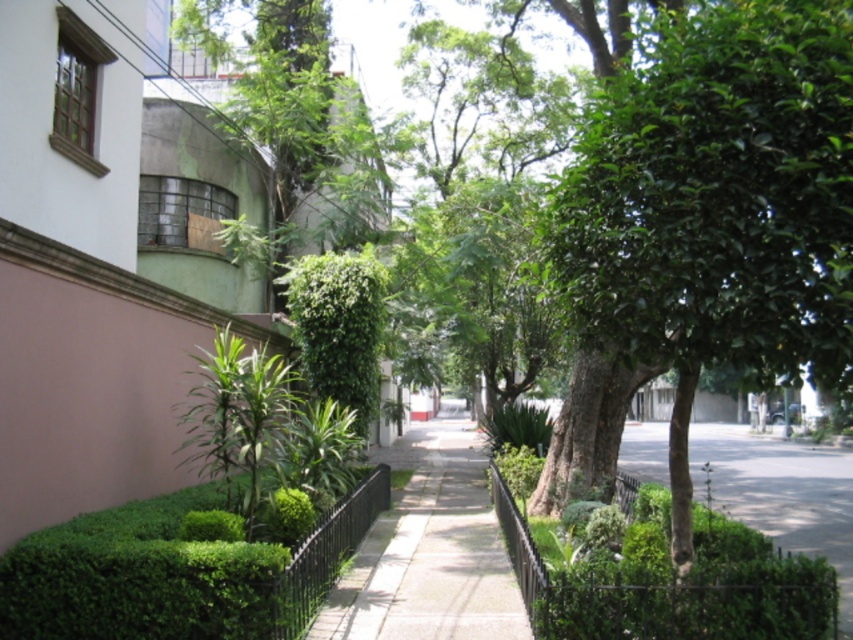
Is point (840, 378) more distant than point (167, 525)?

No, (840, 378) is closer to viewer.

Between green leafy tree at center and green leafy hedge at center, which one is positioned higher?

green leafy tree at center is above.

The height and width of the screenshot is (640, 853). Identify the location of green leafy tree at center. (718, 208).

Locate an element on the screen. The width and height of the screenshot is (853, 640). green leafy tree at center is located at coordinates (718, 208).

Does green leafy tree at center have a smaller size compared to paved concrete sidewalk at center?

Yes.

Where is `green leafy tree at center`? The height and width of the screenshot is (640, 853). green leafy tree at center is located at coordinates 718,208.

Where is `green leafy tree at center`? The width and height of the screenshot is (853, 640). green leafy tree at center is located at coordinates (718, 208).

Consider the image. Can you confirm if green leafy hedge at center is taller than paved concrete sidewalk at center?

No.

Is green leafy hedge at center further to the viewer compared to paved concrete sidewalk at center?

No.

Is point (78, 636) closer to camera compared to point (412, 611)?

Yes, point (78, 636) is closer to viewer.

Where is `green leafy hedge at center`? This screenshot has width=853, height=640. green leafy hedge at center is located at coordinates click(173, 573).